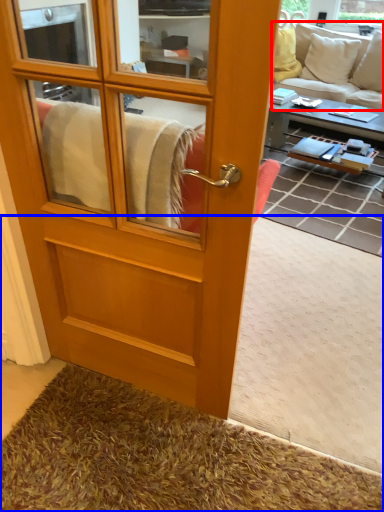
Question: Which object is closer to the camera taking this photo, studio couch (highlighted by a red box) or carpets (highlighted by a blue box)?

Choices:
 (A) studio couch
 (B) carpets

Answer: (B)